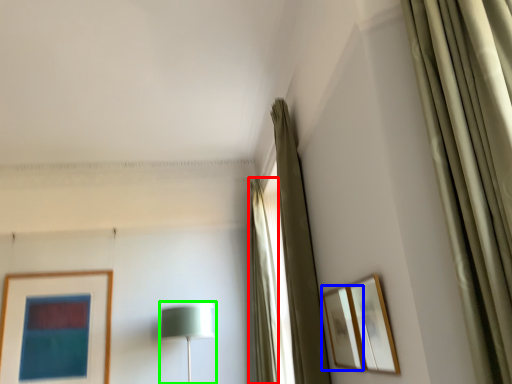
Question: Based on their relative distances, which object is nearer to curtain (highlighted by a red box)? Choose from picture frame (highlighted by a blue box) and table lamp (highlighted by a green box).

Choices:
 (A) picture frame
 (B) table lamp

Answer: (B)